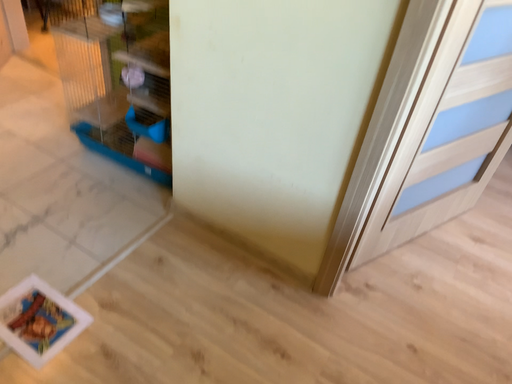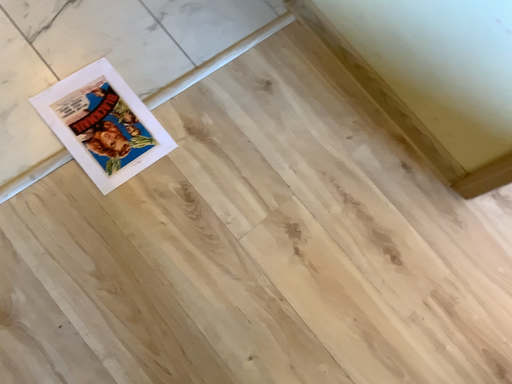
Question: How did the camera likely rotate when shooting the video?

Choices:
 (A) rotated right
 (B) rotated left

Answer: (B)